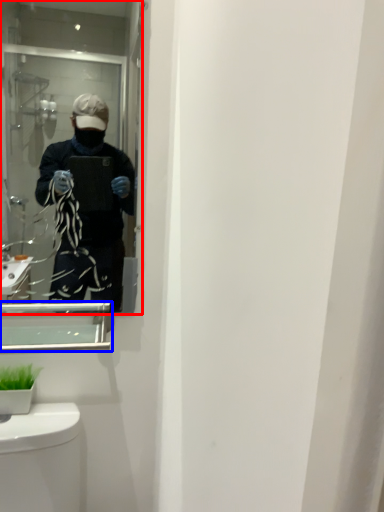
Question: Among these objects, which one is nearest to the camera, mirror (highlighted by a red box) or medicine cabinet (highlighted by a blue box)?

Choices:
 (A) mirror
 (B) medicine cabinet

Answer: (A)